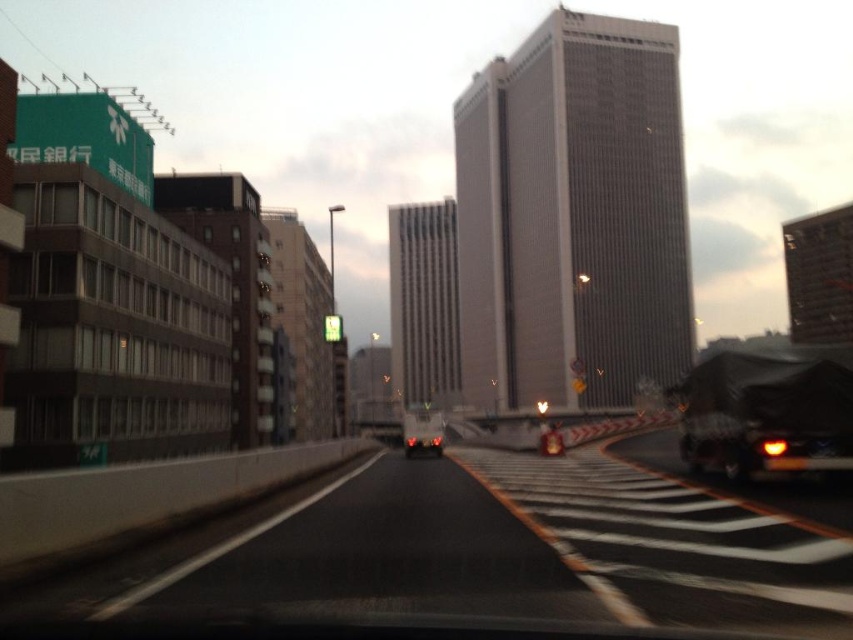
Is black asphalt highway at center wider than matte black car at center?

Correct, the width of black asphalt highway at center exceeds that of matte black car at center.

Between black asphalt highway at center and matte black car at center, which one appears on the right side from the viewer's perspective?

black asphalt highway at center

This screenshot has width=853, height=640. Find the location of `black asphalt highway at center`. black asphalt highway at center is located at coordinates (486, 552).

Is point (323, 573) closer to viewer compared to point (741, 420)?

Yes, it is in front of point (741, 420).

Which of these two, black asphalt highway at center or black matte truck at right, stands shorter?

black asphalt highway at center

The image size is (853, 640). I want to click on black asphalt highway at center, so click(x=486, y=552).

Is black matte truck at right bigger than matte black car at center?

Actually, black matte truck at right might be smaller than matte black car at center.

Is black matte truck at right positioned before matte black car at center?

Yes, it is in front of matte black car at center.

Who is more distant from viewer, (726, 444) or (418, 422)?

Positioned behind is point (418, 422).

At what (x,y) coordinates should I click in order to perform the action: click on black matte truck at right. Please return your answer as a coordinate pair (x, y). Image resolution: width=853 pixels, height=640 pixels. Looking at the image, I should click on (767, 412).